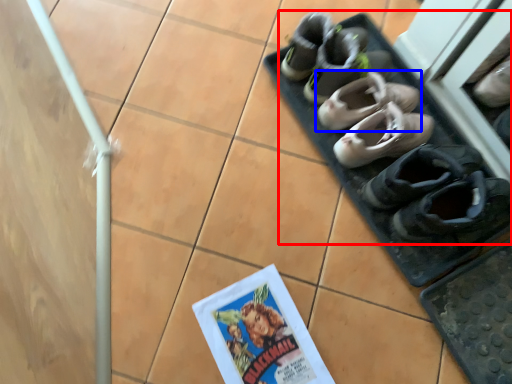
Question: Which object appears farthest to the camera in this image, footwear (highlighted by a red box) or footwear (highlighted by a blue box)?

Choices:
 (A) footwear
 (B) footwear

Answer: (B)